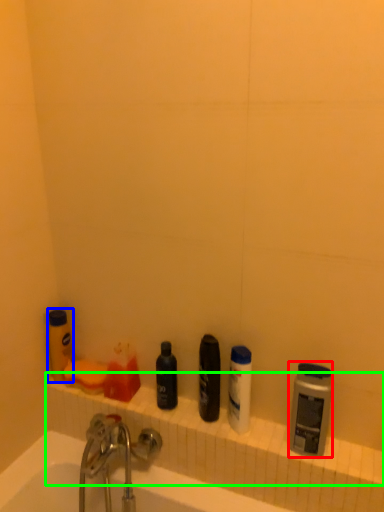
Question: Estimate the real-world distances between objects in this image. Which object is closer to toiletry (highlighted by a red box), toiletry (highlighted by a blue box) or ledge (highlighted by a green box)?

Choices:
 (A) toiletry
 (B) ledge

Answer: (B)